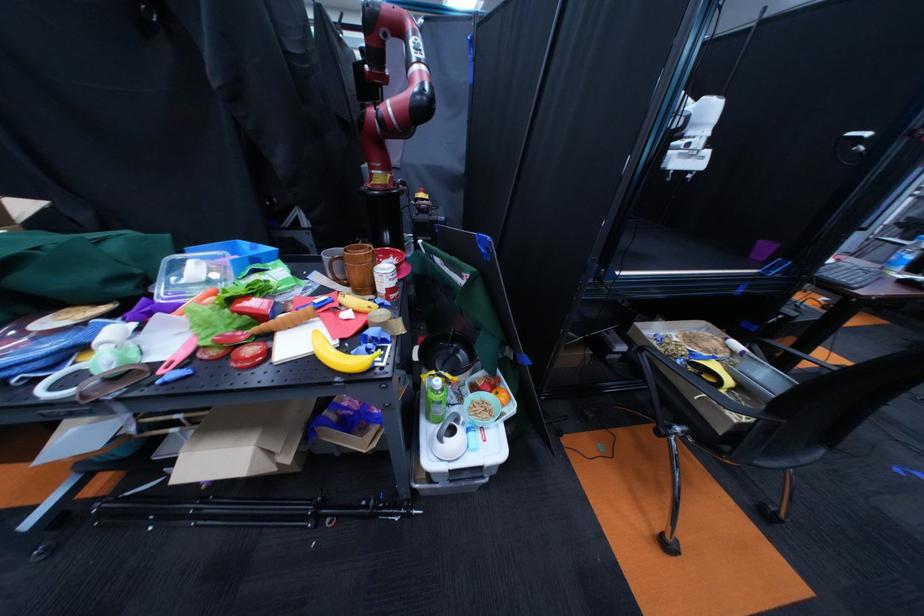
Where would you lift the yellow toy banana? Please return your answer as a coordinate pair (x, y).

(339, 355)